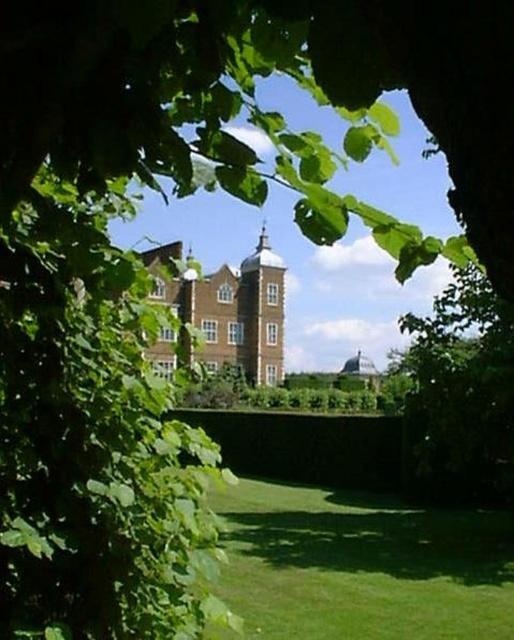
Is point (309, 560) positioned in front of point (411, 392)?

Yes, it is.

Is green grass at lower center smaller than green leafy tree at lower right?

Incorrect, green grass at lower center is not smaller in size than green leafy tree at lower right.

Locate an element on the screen. green grass at lower center is located at coordinates (360, 566).

Does point (458, 460) come in front of point (270, 381)?

Yes, point (458, 460) is in front of point (270, 381).

Can you confirm if green leafy tree at lower right is smaller than brown stone bell tower at center?

Incorrect, green leafy tree at lower right is not smaller in size than brown stone bell tower at center.

The image size is (514, 640). In order to click on green leafy tree at lower right in this screenshot , I will do `click(461, 394)`.

Between green grass at lower center and brown stone bell tower at center, which one appears on the left side from the viewer's perspective?

Positioned to the left is brown stone bell tower at center.

Image resolution: width=514 pixels, height=640 pixels. What are the coordinates of `green grass at lower center` in the screenshot? It's located at (360, 566).

Locate an element on the screen. green grass at lower center is located at coordinates [x=360, y=566].